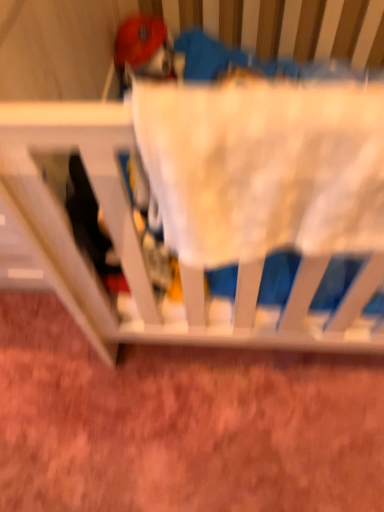
Describe the element at coordinates (179, 256) in the screenshot. I see `white lace fabric at center` at that location.

This screenshot has width=384, height=512. Find the location of `white lace fabric at center`. white lace fabric at center is located at coordinates (179, 256).

Locate an element on the screen. The height and width of the screenshot is (512, 384). white lace fabric at center is located at coordinates (179, 256).